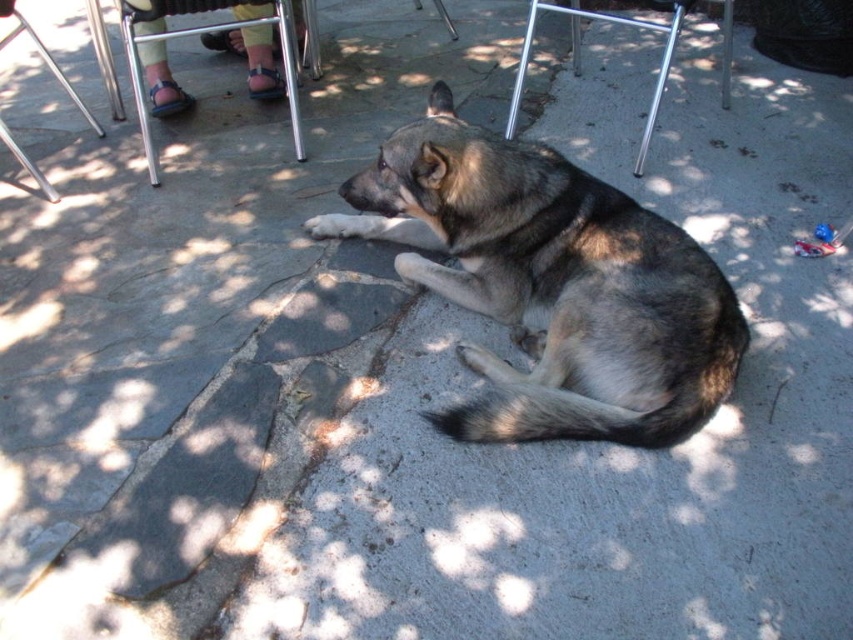
You are standing at the point marked as point (262, 29) in the image. You want to throw a ball to a friend who is standing 10 feet away from you. Is your friend within the visible area of the image?

The distance between point (262, 29) and the viewer is 9.76 feet. Since your friend is 10 feet away, they are just beyond the visible area of the image.

You are a photographer setting up a shoot. You need to place a 1.8m tall mannequin between the metallic silver chair at upper center and the brushed metal chair at upper left. Can the mannequin stand upright without hitting its head on either chair?

The metallic silver chair at upper center is taller than the brushed metal chair at upper left. Since the mannequin is 1.8 meters tall, it depends on the actual height of the taller chair. If the metallic silver chair at upper center is taller than 1.8 meters, then the mannequin can stand upright without hitting its head. However, if the chair is shorter than 1.8 meters, it might not fit. The information provided does not specify the exact height, so we cannot confirm for certain.